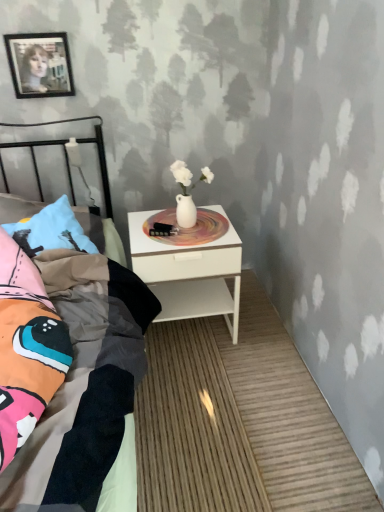
The width and height of the screenshot is (384, 512). In order to click on vacant space underneath white glossy nightstand at center (from a real-world perspective) in this screenshot , I will do `click(195, 330)`.